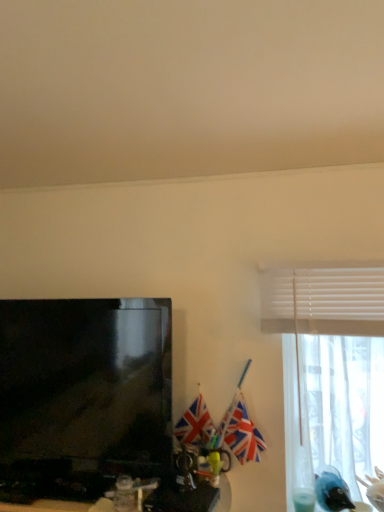
The image size is (384, 512). I want to click on matte black television at left, so click(x=83, y=395).

The image size is (384, 512). What do you see at coordinates (333, 409) in the screenshot?
I see `sheer white curtain at right` at bounding box center [333, 409].

At what (x,y) coordinates should I click in order to perform the action: click on polyester flag at center, marked as the second flag in a right-to-left arrangement. Please return your answer as a coordinate pair (x, y). The width and height of the screenshot is (384, 512). Looking at the image, I should click on (194, 423).

Where is `shiny plastic computer desk at lower left`? The width and height of the screenshot is (384, 512). shiny plastic computer desk at lower left is located at coordinates (193, 498).

Could you tell me if matte black television at left is turned towards polyester flag at center, the first flag when ordered from left to right?

No, matte black television at left does not turn towards polyester flag at center, the first flag when ordered from left to right.

Locate an element on the screen. This screenshot has width=384, height=512. the 1st flag located beneath the matte black television at left (from a real-world perspective) is located at coordinates (194, 423).

Considering the sizes of objects matte black television at left and polyester flag at center, marked as the second flag in a right-to-left arrangement, in the image provided, who is bigger, matte black television at left or polyester flag at center, marked as the second flag in a right-to-left arrangement,?

matte black television at left is bigger.

From the image's perspective, who appears lower, matte black television at left or polyester flag at center, the first flag when ordered from left to right?

polyester flag at center, the first flag when ordered from left to right, is shown below in the image.

From the image's perspective, between matte black television at left and shiny plastic computer desk at lower left, which one is located above?

matte black television at left.

From a real-world perspective, between matte black television at left and shiny plastic computer desk at lower left, who is vertically lower?

shiny plastic computer desk at lower left is physically lower.

Considering the positions of point (119, 456) and point (216, 508), is point (119, 456) closer or farther from the camera than point (216, 508)?

Point (119, 456) is closer to the camera than point (216, 508).

Which is correct: matte black television at left is inside shiny plastic computer desk at lower left, or outside of it?

matte black television at left cannot be found inside shiny plastic computer desk at lower left.

Considering the relative positions of polyester flag at center, marked as the second flag in a right-to-left arrangement, and sheer white curtain at right in the image provided, is polyester flag at center, marked as the second flag in a right-to-left arrangement, to the right of sheer white curtain at right from the viewer's perspective?

No, polyester flag at center, marked as the second flag in a right-to-left arrangement, is not to the right of sheer white curtain at right.

From a real-world perspective, is polyester flag at center, marked as the second flag in a right-to-left arrangement, positioned under sheer white curtain at right based on gravity?

No, from a real-world perspective, polyester flag at center, marked as the second flag in a right-to-left arrangement, is not below sheer white curtain at right.

Can sheer white curtain at right be found inside polyester flag at center, marked as the second flag in a right-to-left arrangement?

No, sheer white curtain at right is not inside polyester flag at center, marked as the second flag in a right-to-left arrangement.

Could you tell me if polyester flag at center, marked as the second flag in a right-to-left arrangement, is turned towards sheer white curtain at right?

No, polyester flag at center, marked as the second flag in a right-to-left arrangement, is not facing towards sheer white curtain at right.

Can you tell me how much sheer white curtain at right and union jack flag at right, positioned as the 1th flag in right-to-left order, differ in facing direction?

1.5 degrees separate the facing orientations of sheer white curtain at right and union jack flag at right, positioned as the 1th flag in right-to-left order.

What are the coordinates of `curtain below the union jack flag at right, positioned as the 1th flag in right-to-left order (from a real-world perspective)` in the screenshot? It's located at (333, 409).

Looking at this image, which object is wider, sheer white curtain at right or union jack flag at right, positioned as the 1th flag in right-to-left order?

sheer white curtain at right is wider.

Considering the positions of objects sheer white curtain at right and union jack flag at right, arranged as the 2th flag when viewed from the left, in the image provided, who is more to the right, sheer white curtain at right or union jack flag at right, arranged as the 2th flag when viewed from the left,?

Positioned to the right is sheer white curtain at right.

Is union jack flag at right, positioned as the 1th flag in right-to-left order, facing away from matte black television at left?

That's not correct — union jack flag at right, positioned as the 1th flag in right-to-left order, is not looking away from matte black television at left.

Is union jack flag at right, arranged as the 2th flag when viewed from the left, not inside matte black television at left?

Yes, union jack flag at right, arranged as the 2th flag when viewed from the left, is not within matte black television at left.

From a real-world perspective, is union jack flag at right, positioned as the 1th flag in right-to-left order, on top of matte black television at left?

No.

Is shiny plastic computer desk at lower left positioned with its back to matte black television at left?

shiny plastic computer desk at lower left is not turned away from matte black television at left.

Is shiny plastic computer desk at lower left shorter than matte black television at left?

Correct, shiny plastic computer desk at lower left is not as tall as matte black television at left.

From the image's perspective, would you say shiny plastic computer desk at lower left is shown under matte black television at left?

Yes, from the image's perspective, shiny plastic computer desk at lower left is beneath matte black television at left.

Are polyester flag at center, the first flag when ordered from left to right, and union jack flag at right, arranged as the 2th flag when viewed from the left, beside each other?

polyester flag at center, the first flag when ordered from left to right, and union jack flag at right, arranged as the 2th flag when viewed from the left, are clearly separated.

From the image's perspective, which is below, polyester flag at center, marked as the second flag in a right-to-left arrangement, or union jack flag at right, arranged as the 2th flag when viewed from the left?

polyester flag at center, marked as the second flag in a right-to-left arrangement.

In the image, is polyester flag at center, the first flag when ordered from left to right, positioned in front of or behind union jack flag at right, arranged as the 2th flag when viewed from the left?

Visually, polyester flag at center, the first flag when ordered from left to right, is located behind union jack flag at right, arranged as the 2th flag when viewed from the left.

Identify the location of flag on the left of union jack flag at right, positioned as the 1th flag in right-to-left order. The height and width of the screenshot is (512, 384). (194, 423).

Image resolution: width=384 pixels, height=512 pixels. Identify the location of the 1st flag directly beneath the matte black television at left (from a real-world perspective). (194, 423).

Find the location of a particular element. computer desk in front of the matte black television at left is located at coordinates (193, 498).

Estimate the real-world distances between objects in this image. Which object is further from union jack flag at right, arranged as the 2th flag when viewed from the left, sheer white curtain at right or polyester flag at center, the first flag when ordered from left to right?

sheer white curtain at right is further to union jack flag at right, arranged as the 2th flag when viewed from the left.

Based on their spatial positions, is union jack flag at right, arranged as the 2th flag when viewed from the left, or sheer white curtain at right closer to shiny plastic computer desk at lower left?

union jack flag at right, arranged as the 2th flag when viewed from the left, is closer to shiny plastic computer desk at lower left.

Consider the image. When comparing their distances from shiny plastic computer desk at lower left, does union jack flag at right, positioned as the 1th flag in right-to-left order, or polyester flag at center, the first flag when ordered from left to right, seem further?

The object further to shiny plastic computer desk at lower left is union jack flag at right, positioned as the 1th flag in right-to-left order.

Estimate the real-world distances between objects in this image. Which object is closer to matte black television at left, shiny plastic computer desk at lower left or polyester flag at center, marked as the second flag in a right-to-left arrangement?

shiny plastic computer desk at lower left is positioned closer to the anchor matte black television at left.

Looking at the image, which one is located closer to sheer white curtain at right, matte black television at left or shiny plastic computer desk at lower left?

shiny plastic computer desk at lower left.

Estimate the real-world distances between objects in this image. Which object is closer to matte black television at left, sheer white curtain at right or union jack flag at right, positioned as the 1th flag in right-to-left order?

union jack flag at right, positioned as the 1th flag in right-to-left order.

Looking at the image, which one is located closer to union jack flag at right, arranged as the 2th flag when viewed from the left, sheer white curtain at right or matte black television at left?

sheer white curtain at right is closer to union jack flag at right, arranged as the 2th flag when viewed from the left.

Estimate the real-world distances between objects in this image. Which object is further from union jack flag at right, arranged as the 2th flag when viewed from the left, matte black television at left or polyester flag at center, the first flag when ordered from left to right?

matte black television at left is positioned further to the anchor union jack flag at right, arranged as the 2th flag when viewed from the left.

You are a GUI agent. You are given a task and a screenshot of the screen. Output one action in this format:
    pyautogui.click(x=<x>, y=<y>)
    Task: Click on the flag situated between shiny plastic computer desk at lower left and union jack flag at right, positioned as the 1th flag in right-to-left order, from left to right
    Image resolution: width=384 pixels, height=512 pixels.
    Given the screenshot: What is the action you would take?
    pyautogui.click(x=194, y=423)

What are the coordinates of `computer desk situated between matte black television at left and union jack flag at right, arranged as the 2th flag when viewed from the left, from left to right` in the screenshot? It's located at (193, 498).

The width and height of the screenshot is (384, 512). I want to click on computer desk between matte black television at left and polyester flag at center, the first flag when ordered from left to right, in the horizontal direction, so click(x=193, y=498).

Where is `flag between polyester flag at center, the first flag when ordered from left to right, and sheer white curtain at right`? flag between polyester flag at center, the first flag when ordered from left to right, and sheer white curtain at right is located at coordinates (241, 432).